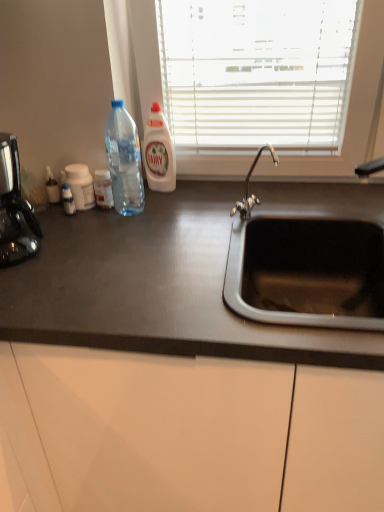
You are a GUI agent. You are given a task and a screenshot of the screen. Output one action in this format:
    pyautogui.click(x=<x>, y=<y>)
    Task: Click on the vacant space in front of white plastic bottle at center
    
    Given the screenshot: What is the action you would take?
    pyautogui.click(x=169, y=206)